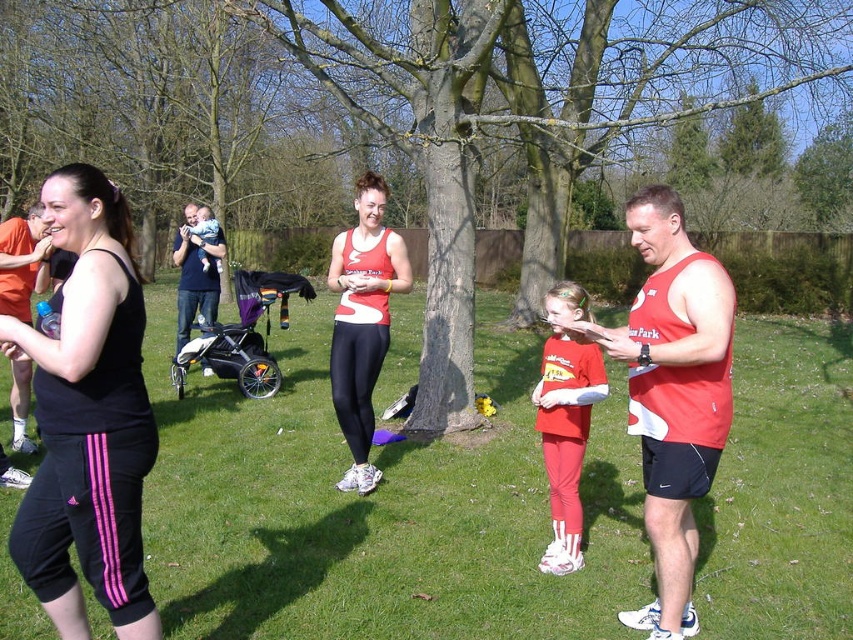
Question: Where is green grass at center located in relation to matte red tank top at center in the image?

Choices:
 (A) above
 (B) below

Answer: (B)

Question: Which point is closer to the camera?

Choices:
 (A) matte red tank top at center
 (B) matte black tank top at left
 (C) red sleeveless shirt at center
 (D) dark blue t-shirt at upper left

Answer: (C)

Question: Can you confirm if red sleeveless shirt at center is smaller than soft white baby at center?

Choices:
 (A) no
 (B) yes

Answer: (A)

Question: From the image, what is the correct spatial relationship of black matte tank top at left in relation to dark blue t-shirt at upper left?

Choices:
 (A) above
 (B) below

Answer: (B)

Question: Which of these objects is positioned closest to the green grass at center?

Choices:
 (A) red sleeveless shirt at center
 (B) matte red leggings at center

Answer: (B)

Question: Which of the following is the farthest from the observer?

Choices:
 (A) (683, 499)
 (B) (22, 298)
 (C) (277, 381)

Answer: (C)